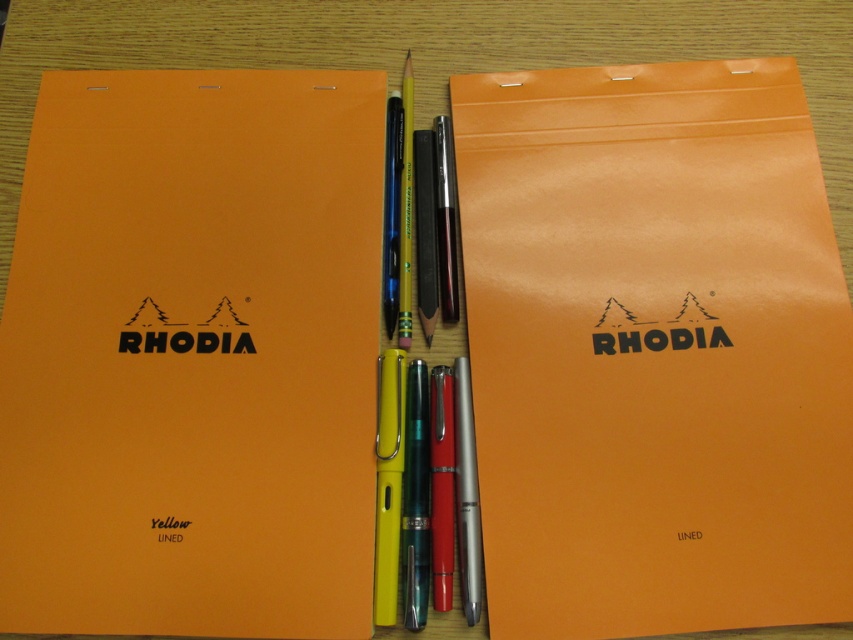
Who is positioned more to the left, orange matte rhodia notebook at center or matte orange notebook at left?

matte orange notebook at left is more to the left.

Is orange matte rhodia notebook at center further to camera compared to matte orange notebook at left?

Yes.

Where is `orange matte rhodia notebook at center`? The height and width of the screenshot is (640, 853). orange matte rhodia notebook at center is located at coordinates (654, 349).